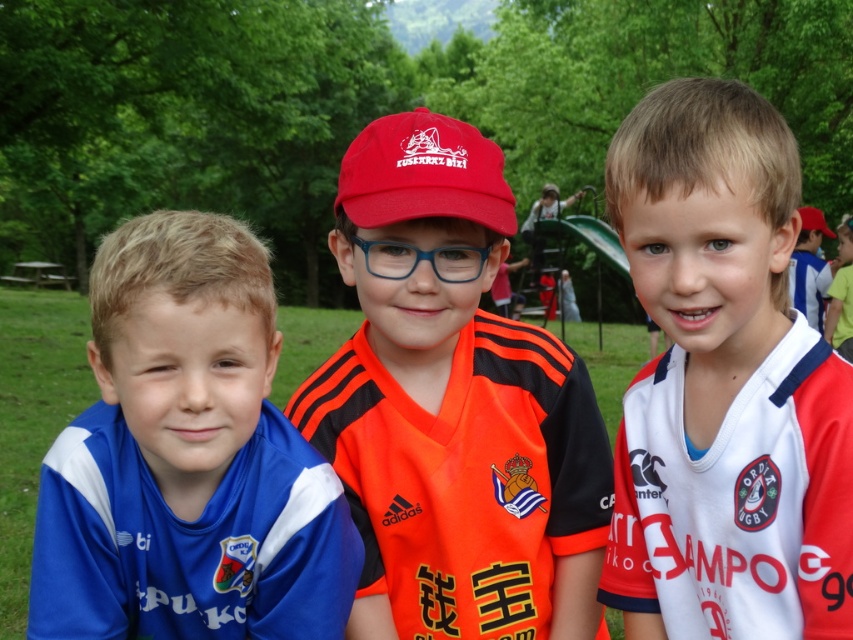
Question: Can you confirm if white jersey at center is thinner than blue jersey at left?

Choices:
 (A) no
 (B) yes

Answer: (B)

Question: Is blue jersey at left to the left of matte red baseball cap at center from the viewer's perspective?

Choices:
 (A) yes
 (B) no

Answer: (A)

Question: Which object is closer to the camera taking this photo?

Choices:
 (A) white jersey at center
 (B) blue jersey at left

Answer: (A)

Question: Which object appears closest to the camera in this image?

Choices:
 (A) blue jersey at left
 (B) orange jersey at center
 (C) white jersey at center

Answer: (C)

Question: Is white jersey at center closer to camera compared to blue jersey at left?

Choices:
 (A) yes
 (B) no

Answer: (A)

Question: Which of the following is the farthest from the observer?

Choices:
 (A) matte red baseball cap at center
 (B) blue jersey at left

Answer: (A)